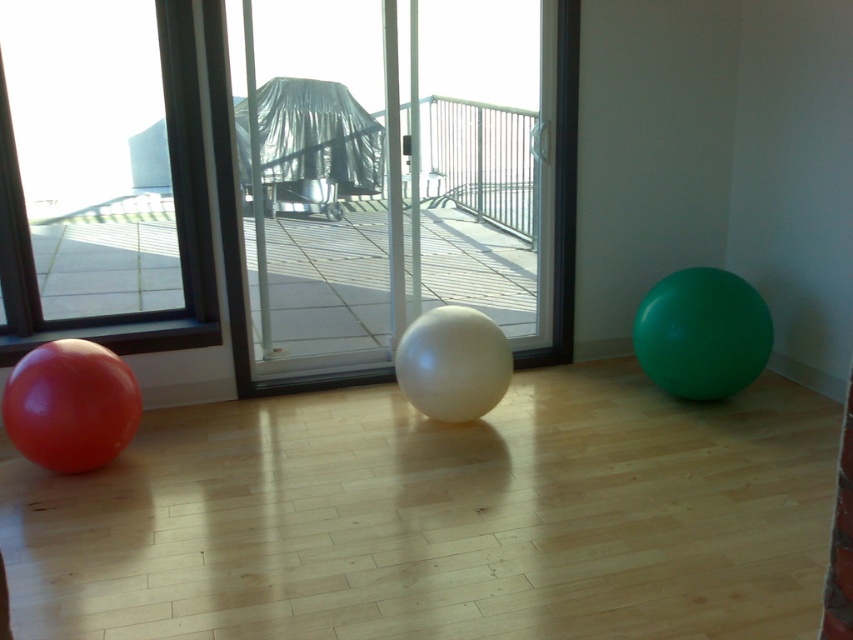
This screenshot has width=853, height=640. In order to click on transparent plastic screen door at center in this screenshot , I will do `click(318, 184)`.

Between point (262, 296) and point (503, 390), which one is positioned in front?

Point (503, 390) is in front.

Does point (259, 355) come farther from viewer compared to point (440, 413)?

That is True.

Identify the location of transparent plastic screen door at center. This screenshot has width=853, height=640. (318, 184).

Which is above, matte red balloon at left or white glossy ball at center?

white glossy ball at center is higher up.

The image size is (853, 640). I want to click on matte red balloon at left, so click(x=70, y=404).

Describe the element at coordinates (70, 404) in the screenshot. The height and width of the screenshot is (640, 853). I see `matte red balloon at left` at that location.

Find the location of a particular element. Image resolution: width=853 pixels, height=640 pixels. matte red balloon at left is located at coordinates click(x=70, y=404).

Does transparent plastic screen door at center have a smaller size compared to matte red balloon at left?

No.

Between transparent plastic screen door at center and matte red balloon at left, which one has less height?

With less height is matte red balloon at left.

This screenshot has height=640, width=853. What do you see at coordinates (318, 184) in the screenshot?
I see `transparent plastic screen door at center` at bounding box center [318, 184].

Find the location of a particular element. transparent plastic screen door at center is located at coordinates (318, 184).